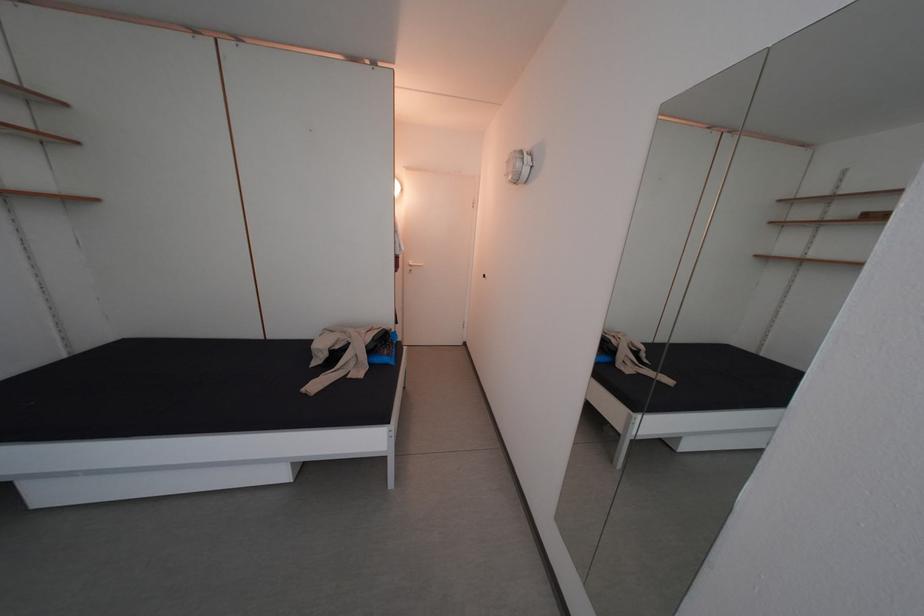
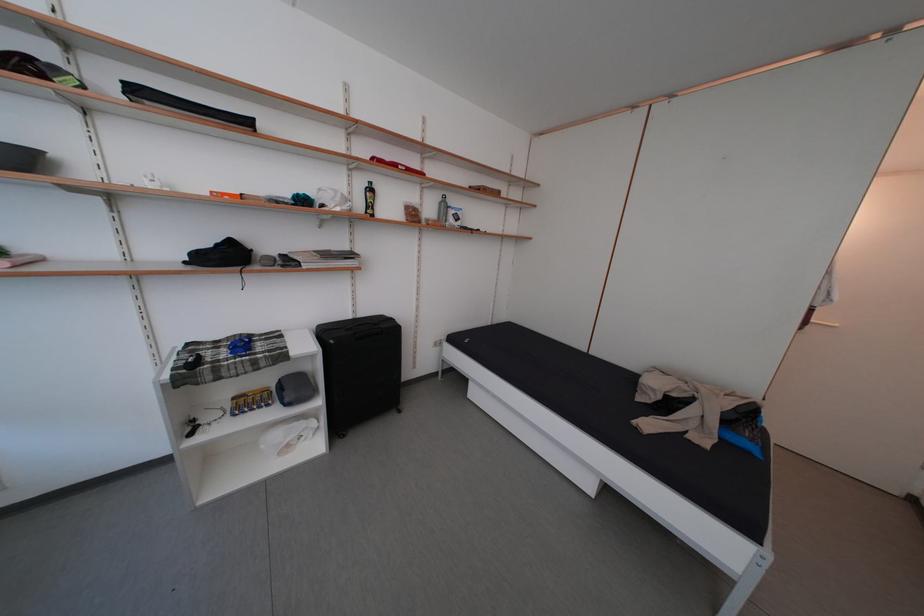
Question: How did the camera likely rotate?

Choices:
 (A) Left
 (B) Right
 (C) Up
 (D) Down

Answer: (A)